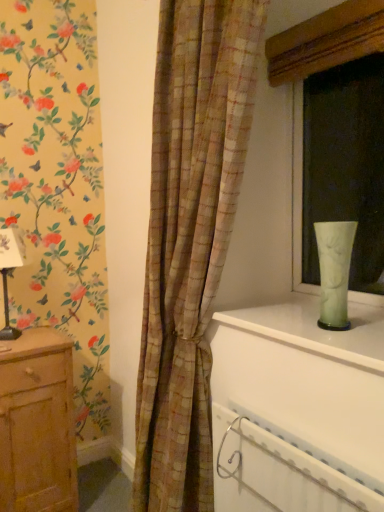
What is the approximate height of white plastic radiator at lower right?

white plastic radiator at lower right is 16.03 inches in height.

Find the location of `wooden chest of drawers at left`. wooden chest of drawers at left is located at coordinates (37, 424).

Where is `matte black table lamp at left`? This screenshot has height=512, width=384. matte black table lamp at left is located at coordinates (7, 273).

Looking at this image, what is the approximate height of green marble vase at upper right?

The height of green marble vase at upper right is 1.84 inches.

The image size is (384, 512). What are the coordinates of `plaid fabric curtain at center` in the screenshot? It's located at (190, 237).

This screenshot has width=384, height=512. I want to click on matte glass vase at right, so click(x=319, y=71).

Which of these two, wooden chest of drawers at left or green marble vase at upper right, stands taller?

wooden chest of drawers at left is taller.

From the image's perspective, who appears lower, wooden chest of drawers at left or green marble vase at upper right?

wooden chest of drawers at left.

Find the location of `chest of drawers on the left of green marble vase at upper right`. chest of drawers on the left of green marble vase at upper right is located at coordinates (37, 424).

From the image's perspective, which object appears higher, wooden chest of drawers at left or white plastic radiator at lower right?

white plastic radiator at lower right appears higher in the image.

Is wooden chest of drawers at left closer to camera compared to white plastic radiator at lower right?

No.

From a real-world perspective, between wooden chest of drawers at left and white plastic radiator at lower right, who is vertically lower?

From a 3D spatial view, wooden chest of drawers at left is below.

Is wooden chest of drawers at left next to white plastic radiator at lower right?

They are not placed beside each other.

Is matte black table lamp at left oriented away from plaid fabric curtain at center?

No, matte black table lamp at left is not facing away from plaid fabric curtain at center.

Considering the positions of objects matte black table lamp at left and plaid fabric curtain at center in the image provided, who is behind, matte black table lamp at left or plaid fabric curtain at center?

Positioned behind is matte black table lamp at left.

Is matte black table lamp at left wider than plaid fabric curtain at center?

No.

Considering the relative sizes of matte black table lamp at left and plaid fabric curtain at center in the image provided, is matte black table lamp at left smaller than plaid fabric curtain at center?

Correct, matte black table lamp at left occupies less space than plaid fabric curtain at center.

Is white plastic radiator at lower right at the back of plaid fabric curtain at center?

No, plaid fabric curtain at center is not facing the opposite direction of white plastic radiator at lower right.

Does plaid fabric curtain at center have a lesser height compared to white plastic radiator at lower right?

No, plaid fabric curtain at center is not shorter than white plastic radiator at lower right.

Is point (154, 187) farther from viewer compared to point (215, 426)?

No, it is not.

How distant is plaid fabric curtain at center from white plastic radiator at lower right?

plaid fabric curtain at center is 18.43 inches away from white plastic radiator at lower right.

Which is in front, point (6, 305) or point (325, 232)?

The point (325, 232) is more forward.

Considering the relative positions of matte black table lamp at left and green glass vase at upper right in the image provided, is matte black table lamp at left in front of green glass vase at upper right?

No.

Consider the image. Can you confirm if matte black table lamp at left is bigger than green glass vase at upper right?

Indeed, matte black table lamp at left has a larger size compared to green glass vase at upper right.

Considering the sizes of objects matte black table lamp at left and green glass vase at upper right in the image provided, who is thinner, matte black table lamp at left or green glass vase at upper right?

green glass vase at upper right.

Can you confirm if white plastic radiator at lower right is positioned to the right of matte black table lamp at left?

Yes, white plastic radiator at lower right is to the right of matte black table lamp at left.

Is white plastic radiator at lower right oriented away from matte black table lamp at left?

white plastic radiator at lower right does not have its back to matte black table lamp at left.

Looking at this image, considering the relative positions of white plastic radiator at lower right and matte black table lamp at left in the image provided, is white plastic radiator at lower right in front of matte black table lamp at left?

Yes, white plastic radiator at lower right is closer to the viewer.

Considering the points (233, 436) and (2, 332), which point is behind, point (233, 436) or point (2, 332)?

The point (2, 332) is farther.

Does point (326, 234) appear closer or farther from the camera than point (312, 327)?

Clearly, point (326, 234) is closer to the camera than point (312, 327).

Can you see green glass vase at upper right touching green marble vase at upper right?

No, green glass vase at upper right is not next to green marble vase at upper right.

This screenshot has height=512, width=384. I want to click on window sill above the wooden chest of drawers at left (from a real-world perspective), so click(x=316, y=329).

Locate an element on the screen. The height and width of the screenshot is (512, 384). the chest of drawers behind the white plastic radiator at lower right is located at coordinates (37, 424).

Which object lies nearer to the anchor point white plastic radiator at lower right, matte black table lamp at left or wooden chest of drawers at left?

wooden chest of drawers at left lies closer to white plastic radiator at lower right than the other object.

Which object lies further to the anchor point white plastic radiator at lower right, plaid fabric curtain at center or green marble vase at upper right?

plaid fabric curtain at center lies further to white plastic radiator at lower right than the other object.

When comparing their distances from wooden chest of drawers at left, does matte glass vase at right or white plastic radiator at lower right seem closer?

white plastic radiator at lower right is positioned closer to the anchor wooden chest of drawers at left.

From the image, which object appears to be farther from white plastic radiator at lower right, matte glass vase at right or wooden chest of drawers at left?

The object further to white plastic radiator at lower right is wooden chest of drawers at left.

Estimate the real-world distances between objects in this image. Which object is closer to plaid fabric curtain at center, matte glass vase at right or matte black table lamp at left?

Based on the image, matte glass vase at right appears to be nearer to plaid fabric curtain at center.

Considering their positions, is white plastic radiator at lower right positioned closer to matte glass vase at right than matte black table lamp at left?

The object closer to matte glass vase at right is white plastic radiator at lower right.

Looking at the image, which one is located further to matte glass vase at right, white plastic radiator at lower right or green marble vase at upper right?

white plastic radiator at lower right is positioned further to the anchor matte glass vase at right.

Estimate the real-world distances between objects in this image. Which object is further from matte black table lamp at left, white plastic radiator at lower right or wooden chest of drawers at left?

Based on the image, white plastic radiator at lower right appears to be further to matte black table lamp at left.

Locate an element on the screen. Image resolution: width=384 pixels, height=512 pixels. chest of drawers between matte black table lamp at left and white plastic radiator at lower right in the horizontal direction is located at coordinates (37, 424).

This screenshot has height=512, width=384. In order to click on radiator between wooden chest of drawers at left and green glass vase at upper right from left to right in this screenshot , I will do `click(278, 473)`.

Locate an element on the screen. curtain between matte black table lamp at left and green marble vase at upper right in the horizontal direction is located at coordinates (190, 237).

You are a GUI agent. You are given a task and a screenshot of the screen. Output one action in this format:
    pyautogui.click(x=<x>, y=<y>)
    Task: Click on the chest of drawers between matte black table lamp at left and green marble vase at upper right
    The height and width of the screenshot is (512, 384).
    Given the screenshot: What is the action you would take?
    pyautogui.click(x=37, y=424)